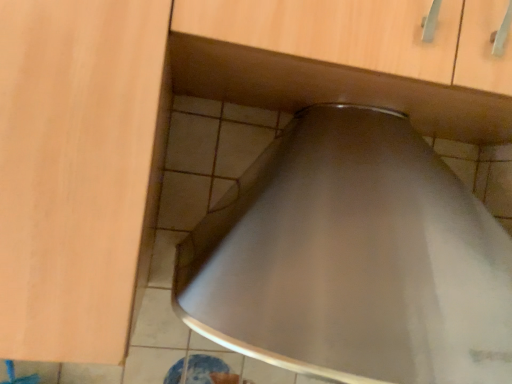
What do you see at coordinates (352, 259) in the screenshot?
I see `stainless steel vent at center` at bounding box center [352, 259].

At what (x,y) coordinates should I click in order to perform the action: click on stainless steel vent at center. Please return your answer as a coordinate pair (x, y). This screenshot has height=384, width=512. Looking at the image, I should click on (352, 259).

What is the approximate width of stainless steel vent at center?

stainless steel vent at center is 18.71 inches in width.

Find the location of a particular element. The width and height of the screenshot is (512, 384). stainless steel vent at center is located at coordinates (352, 259).